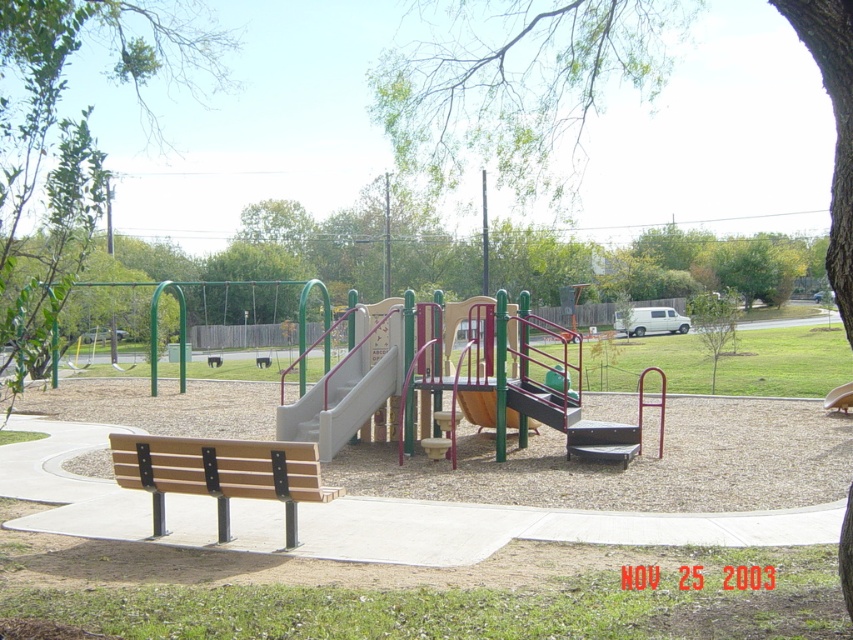
Question: Can you confirm if green matte tree at upper center is bigger than white plastic slide at center?

Choices:
 (A) no
 (B) yes

Answer: (B)

Question: Which object is the farthest from the green leafy tree at upper left?

Choices:
 (A) green leafy tree at upper center
 (B) white plastic slide at center

Answer: (A)

Question: Does green leafy tree at upper center appear on the right side of white plastic slide at center?

Choices:
 (A) yes
 (B) no

Answer: (A)

Question: Is green matte tree at upper center closer to the viewer compared to wooden bench at lower left?

Choices:
 (A) yes
 (B) no

Answer: (A)

Question: Which object is positioned closest to the green matte tree at upper center?

Choices:
 (A) wooden bench at lower left
 (B) green leafy tree at upper center
 (C) green leafy tree at upper left
 (D) white plastic slide at center

Answer: (B)

Question: Which point is closer to the camera taking this photo?

Choices:
 (A) (253, 492)
 (B) (71, 264)
 (C) (494, 58)

Answer: (A)